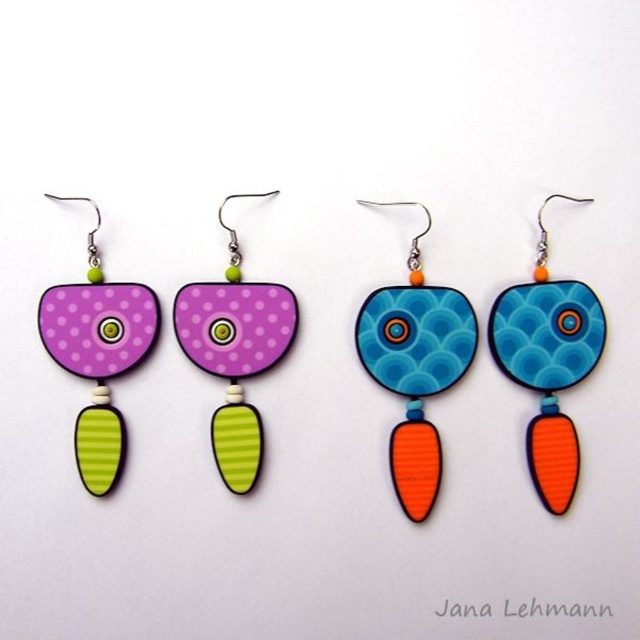
You are an earring designer examining the image. You need to determine the spatial relationship between the blue glossy disc at center and the matte purple wood earring at center. Which object is located above the other?

The blue glossy disc at center is positioned under the matte purple wood earring at center, so the matte purple wood earring at center is above the blue glossy disc at center.

You are an earring designer examining the two earrings. You need to determine which component is taller between the blue glossy circle at center and the matte purple wood earring at center. Which one is taller?

The blue glossy circle at center is taller than the matte purple wood earring at center according to the description.